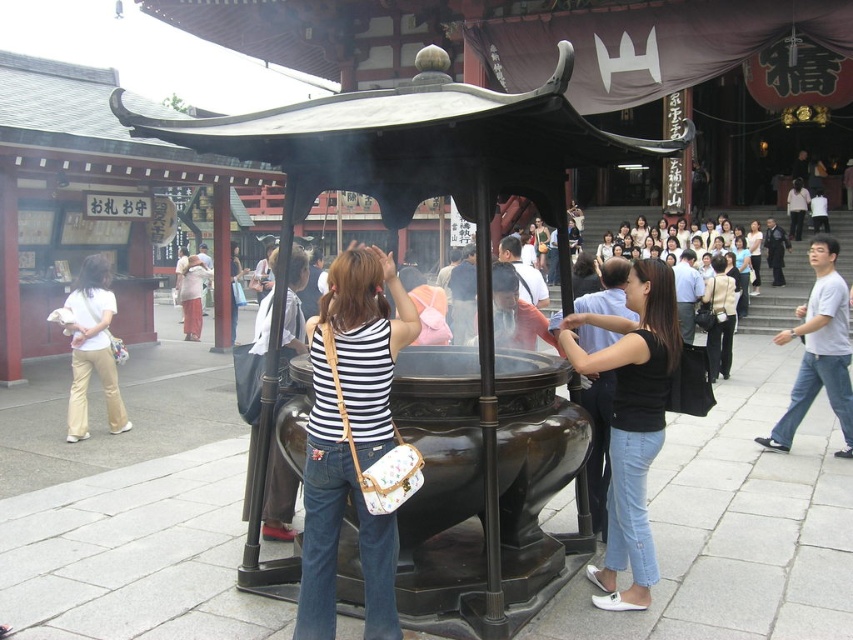
Question: Which point is closer to the camera taking this photo?

Choices:
 (A) (82, 436)
 (B) (367, 310)
 (C) (788, 208)
 (D) (628, 417)

Answer: (B)

Question: Which of the following is the farthest from the observer?

Choices:
 (A) dark gray pants at center
 (B) striped fabric shirt at center

Answer: (A)

Question: Which point is farther from the camera taking this photo?

Choices:
 (A) (635, 356)
 (B) (83, 388)

Answer: (B)

Question: Does striped fabric shirt at center have a lesser width compared to dark gray pants at center?

Choices:
 (A) no
 (B) yes

Answer: (B)

Question: Is black matte shirt at center to the left of dark gray pants at center from the viewer's perspective?

Choices:
 (A) no
 (B) yes

Answer: (B)

Question: Can you confirm if black matte shirt at center is positioned above matte beige pants at lower left?

Choices:
 (A) yes
 (B) no

Answer: (B)